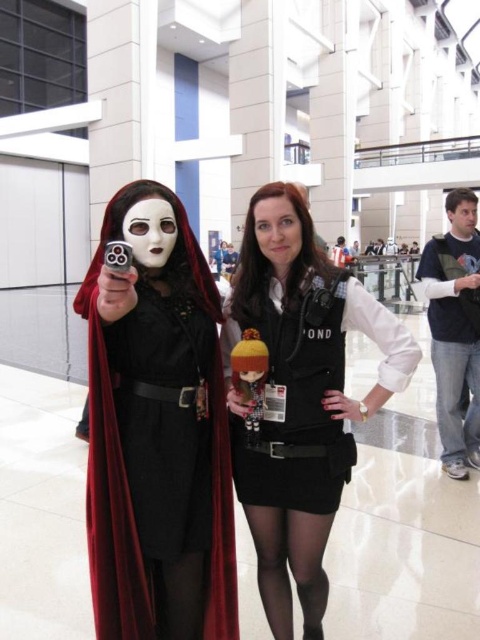
Does matte black vest at center have a greater height compared to navy blue fleece at right?

No.

Is point (299, 410) farther from viewer compared to point (452, 272)?

No, it is not.

I want to click on matte black vest at center, so click(300, 397).

From the picture: Measure the distance between point (199, 256) and camera.

Point (199, 256) and camera are 2.66 meters apart.

Does velvet black cape at center appear on the left side of navy blue fleece at right?

Correct, you'll find velvet black cape at center to the left of navy blue fleece at right.

You are a GUI agent. You are given a task and a screenshot of the screen. Output one action in this format:
    pyautogui.click(x=<x>, y=<y>)
    Task: Click on the velvet black cape at center
    The width and height of the screenshot is (480, 640).
    Given the screenshot: What is the action you would take?
    pyautogui.click(x=157, y=444)

Locate an element on the screen. velvet black cape at center is located at coordinates (157, 444).

Is velvet black cape at center taller than matte black vest at center?

Incorrect, velvet black cape at center's height is not larger of matte black vest at center's.

In the scene shown: Is velvet black cape at center bigger than matte black vest at center?

Indeed, velvet black cape at center has a larger size compared to matte black vest at center.

Where is `velvet black cape at center`? Image resolution: width=480 pixels, height=640 pixels. velvet black cape at center is located at coordinates (157, 444).